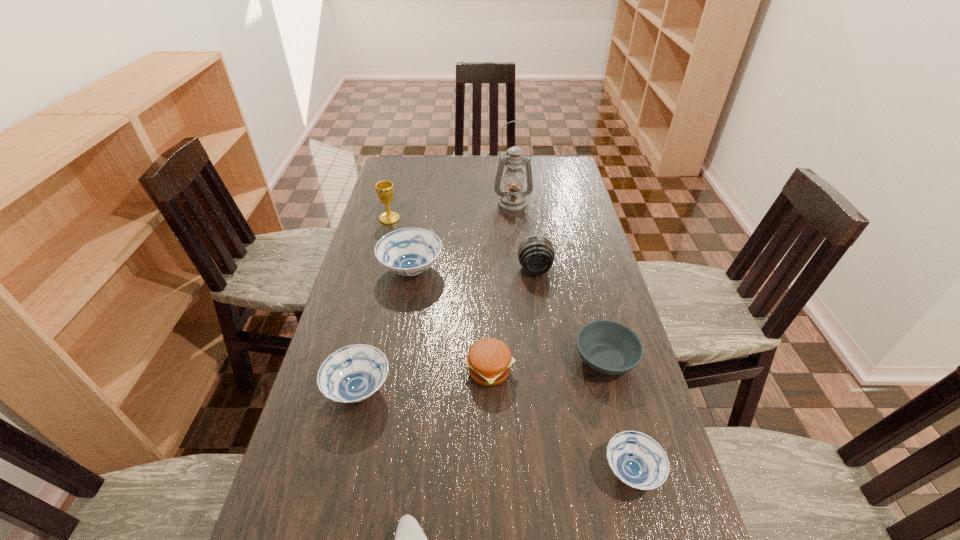
Where is `blank area located 0.050m on the front of the rightmost blue soup bowl`? The image size is (960, 540). blank area located 0.050m on the front of the rightmost blue soup bowl is located at coordinates (646, 529).

Where is `chalice that is at the left edge`? chalice that is at the left edge is located at coordinates (385, 189).

Identify the location of vacant space at the far edge of the desktop. (493, 162).

Identify the location of vacant space at the left edge of the desktop. The height and width of the screenshot is (540, 960). (354, 288).

Image resolution: width=960 pixels, height=540 pixels. In the image, there is a desktop. What are the coordinates of `vacant space at the right edge` in the screenshot? It's located at (559, 232).

At what (x,y) coordinates should I click in order to perform the action: click on free space between the hamburger and the second nearest blue soup bowl. Please return your answer as a coordinate pair (x, y). The width and height of the screenshot is (960, 540). Looking at the image, I should click on (424, 380).

Locate an element on the screen. This screenshot has height=540, width=960. free space that is in between the gray soup bowl and the farthest soup bowl is located at coordinates (508, 315).

The height and width of the screenshot is (540, 960). I want to click on vacant region between the nearest blue soup bowl and the second farthest object, so click(x=511, y=345).

Find the location of a particular element. The width and height of the screenshot is (960, 540). free spot between the telephoto lens and the second farthest blue soup bowl is located at coordinates (446, 329).

This screenshot has width=960, height=540. Find the location of `free space between the oil lamp and the seventh shortest object`. free space between the oil lamp and the seventh shortest object is located at coordinates (523, 236).